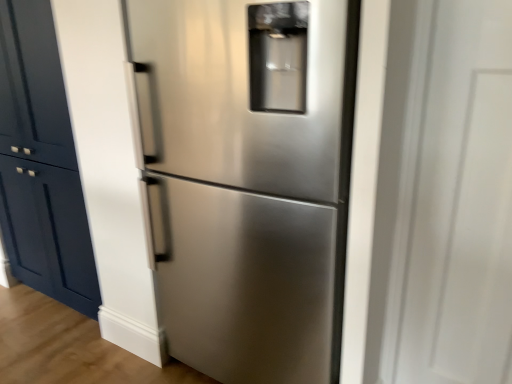
Question: From the image's perspective, is transparent glass door at right above or below matte navy blue cabinet at left?

Choices:
 (A) below
 (B) above

Answer: (A)

Question: Looking at their shapes, would you say transparent glass door at right is wider or thinner than matte navy blue cabinet at left?

Choices:
 (A) thin
 (B) wide

Answer: (B)

Question: Which is nearer to the stainless steel refrigerator at center?

Choices:
 (A) matte navy blue cabinet at left
 (B) transparent glass door at right

Answer: (B)

Question: Estimate the real-world distances between objects in this image. Which object is farther from the stainless steel refrigerator at center?

Choices:
 (A) transparent glass door at right
 (B) matte navy blue cabinet at left

Answer: (B)